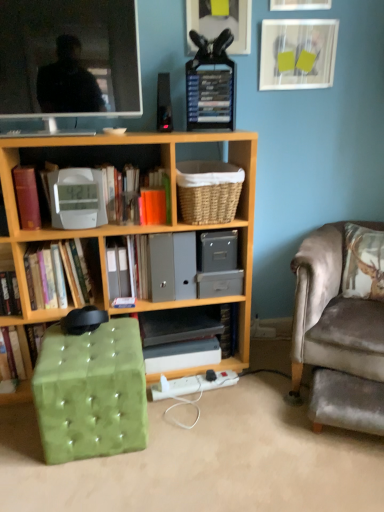
Find the location of a particular element. The image size is (384, 512). vacant area located to the right-hand side of green tufted ottoman at lower left is located at coordinates (194, 433).